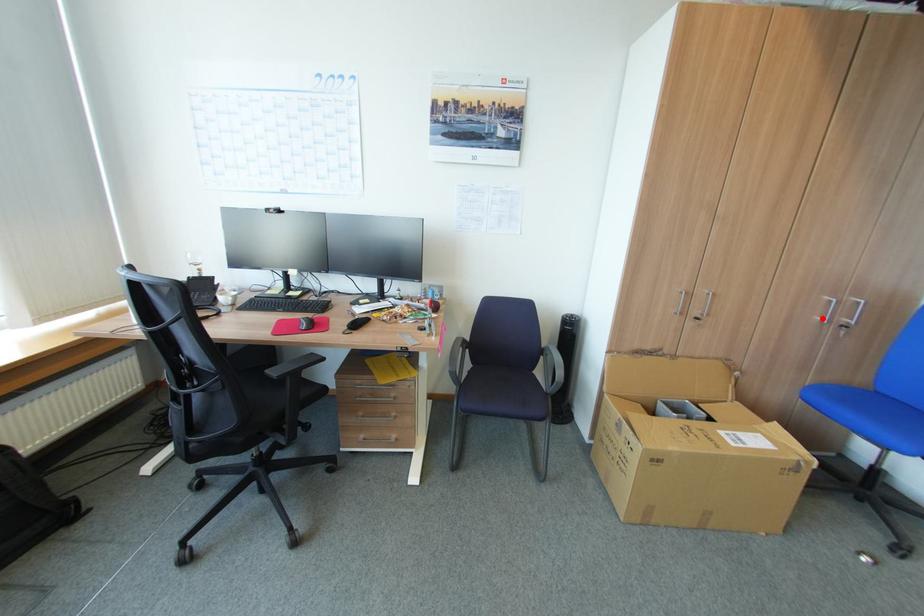
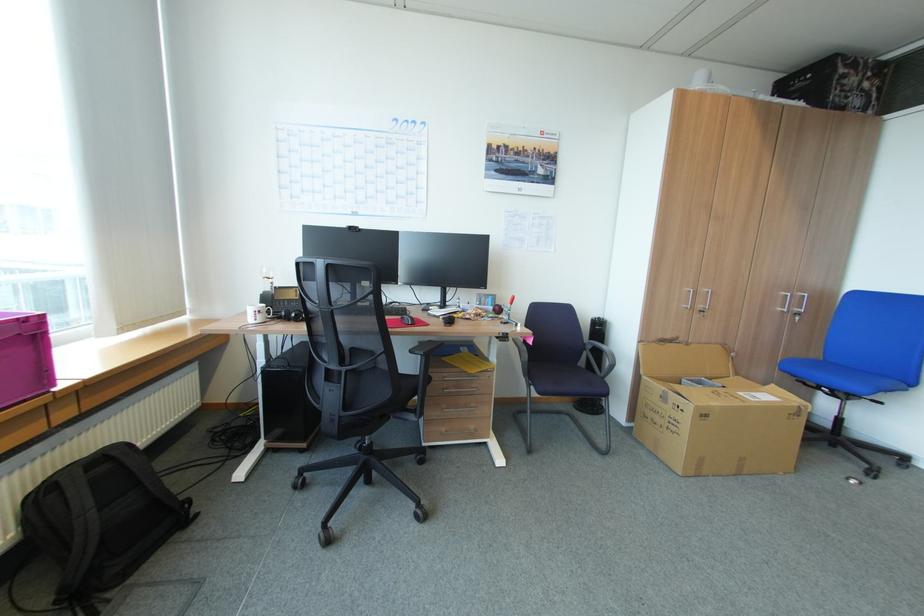
Where in the second image is the point corresponding to the highlighted location from the first image?

(785, 309)